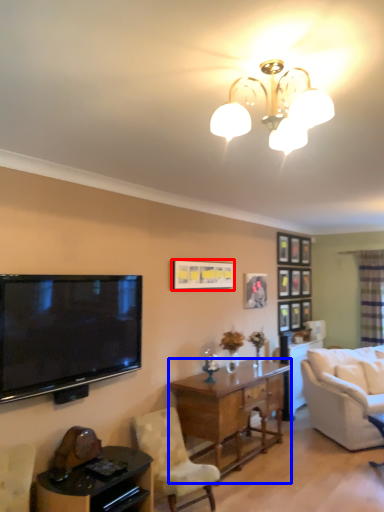
Question: Which point is closer to the camera, picture frame (highlighted by a red box) or desk (highlighted by a blue box)?

Choices:
 (A) picture frame
 (B) desk

Answer: (B)